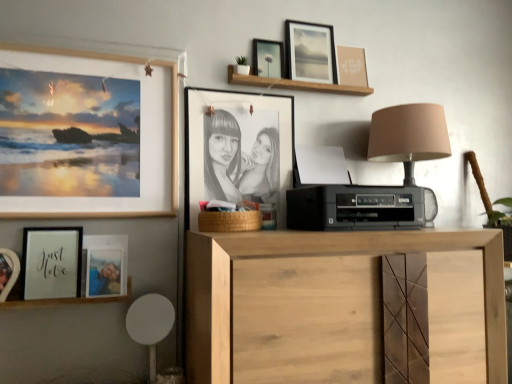
Identify the location of vacant area on top of wooden shelf at upper center, which ranks as the 1th shelf in top-to-bottom order (from a real-world perspective). (307, 79).